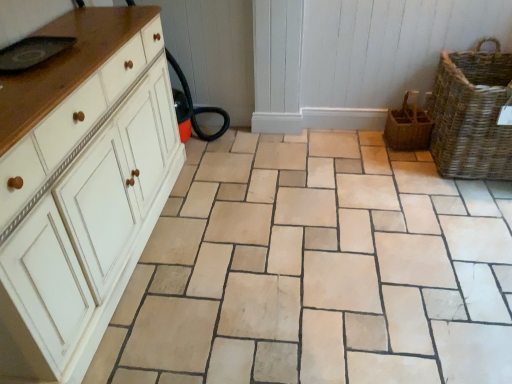
This screenshot has height=384, width=512. In order to click on free space that is to the left of woven brown basket at right, the 1th basket in the left-to-right sequence in this screenshot , I will do `click(361, 145)`.